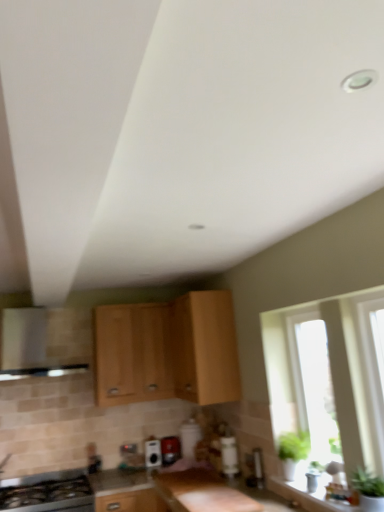
Question: Looking at their shapes, would you say smooth granite countertop at center is wider or thinner than satin black toaster at center, the first appliance when ordered from left to right?

Choices:
 (A) thin
 (B) wide

Answer: (B)

Question: From their relative heights in the image, would you say smooth granite countertop at center is taller or shorter than satin black toaster at center, the first appliance when ordered from left to right?

Choices:
 (A) short
 (B) tall

Answer: (B)

Question: Which object is positioned closest to the light wood cabinet at center, the second cabinetry viewed from the left?

Choices:
 (A) smooth granite countertop at center
 (B) light wood cabinet at center, which is the third cabinetry from left to right
 (C) light wood cabinet at center, which ranks as the third cabinetry in right-to-left order
 (D) satin silver vent at left
 (E) metallic silver toaster at center, which ranks as the first appliance in right-to-left order

Answer: (C)

Question: Which object is the farthest from the satin silver vent at left?

Choices:
 (A) black glass stove at lower left
 (B) metallic silver toaster at center, which ranks as the first appliance in right-to-left order
 (C) light wood cabinet at center, which ranks as the third cabinetry in right-to-left order
 (D) light wood cabinet at center, the 2th cabinetry from the right
 (E) light wood cabinet at center, which is the third cabinetry from left to right

Answer: (B)